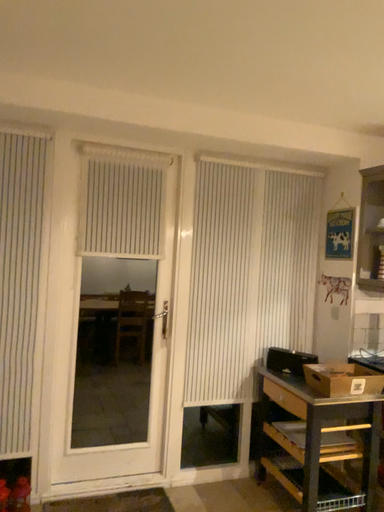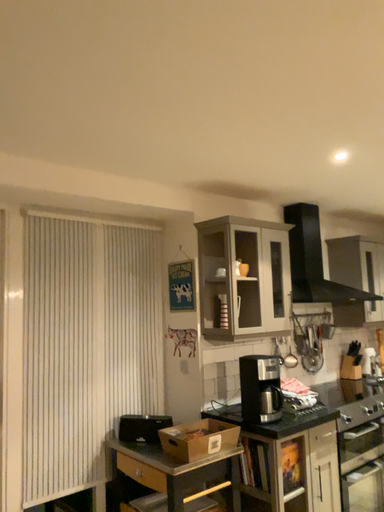
Question: Which way did the camera rotate in the video?

Choices:
 (A) rotated right
 (B) rotated left

Answer: (A)